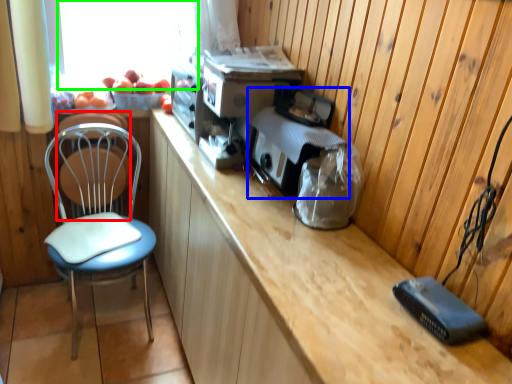
Question: Estimate the real-world distances between objects in this image. Which object is closer to swivel chair (highlighted by a red box), appliance (highlighted by a blue box) or window screen (highlighted by a green box)?

Choices:
 (A) appliance
 (B) window screen

Answer: (B)